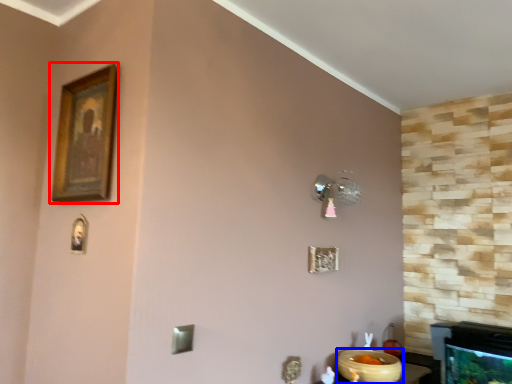
Question: Which object is closer to the camera taking this photo, picture frame (highlighted by a red box) or glass bowl (highlighted by a blue box)?

Choices:
 (A) picture frame
 (B) glass bowl

Answer: (A)